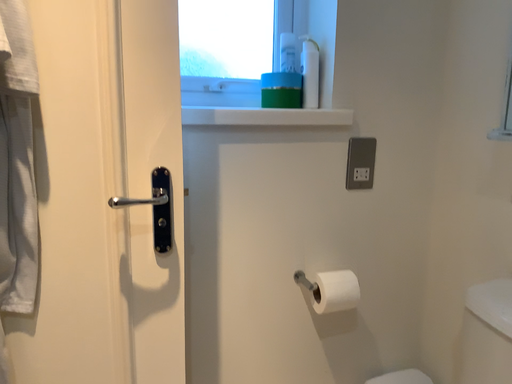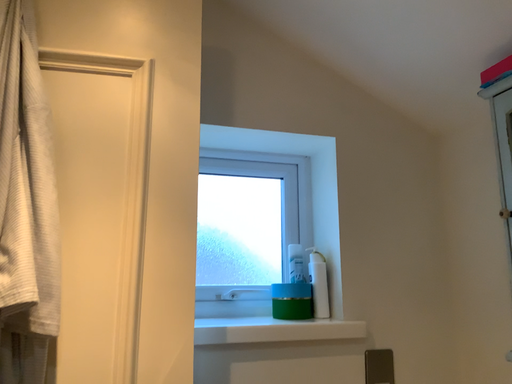
Question: How did the camera likely rotate when shooting the video?

Choices:
 (A) rotated downward
 (B) rotated upward

Answer: (B)